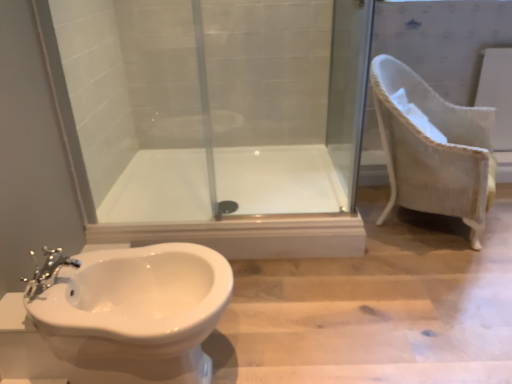
In order to click on vacant space underneath white woven armchair at right (from a real-world perspective) in this screenshot , I will do `click(415, 223)`.